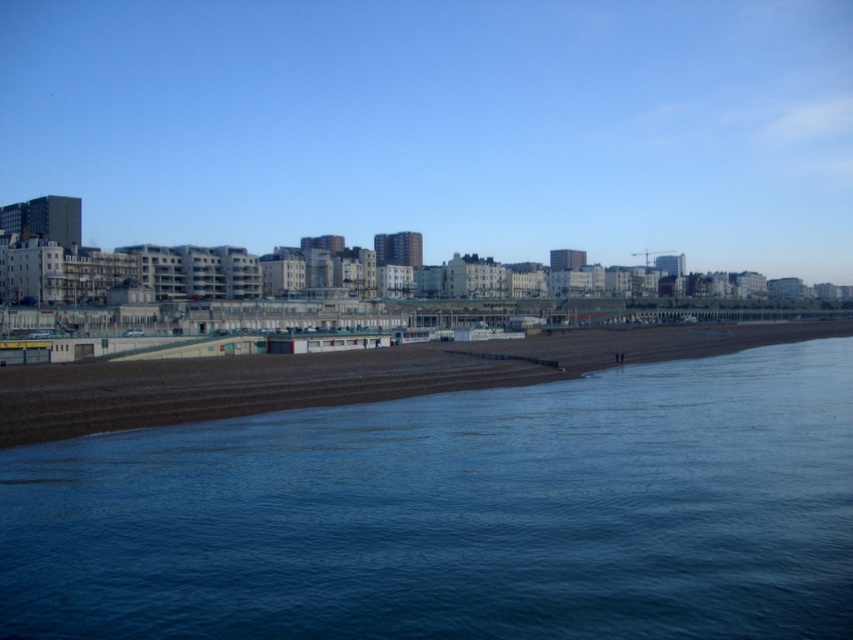
Is blue water at center to the left of brown sand at center from the viewer's perspective?

Indeed, blue water at center is positioned on the left side of brown sand at center.

Is point (61, 468) farther from viewer compared to point (474, 358)?

No, (61, 468) is in front of (474, 358).

Identify the location of blue water at center. (457, 513).